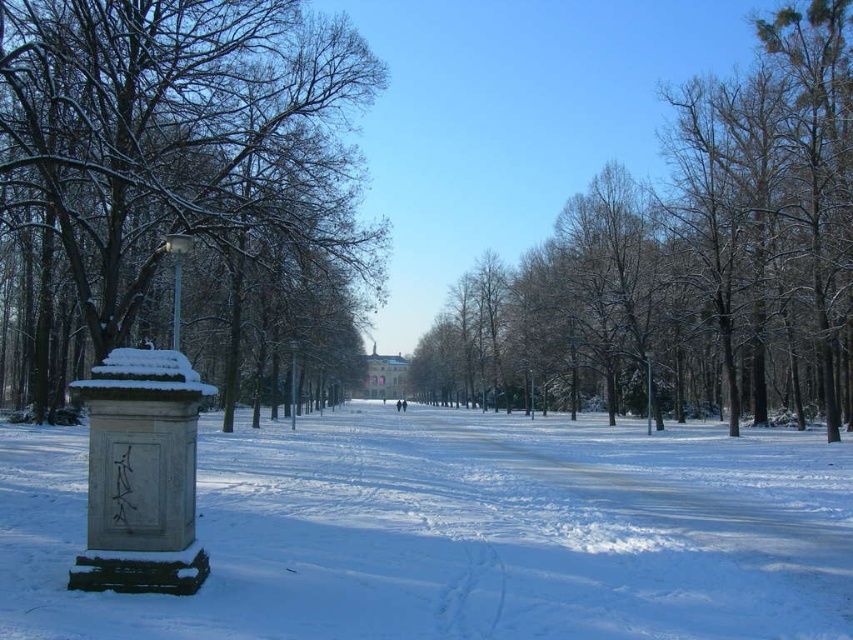
Question: Which is nearer to the white powdery snow at center?

Choices:
 (A) snow-covered tree at left
 (B) snow-covered trees at center

Answer: (A)

Question: Which is nearer to the snow-covered trees at center?

Choices:
 (A) snow-covered tree at left
 (B) white powdery snow at center

Answer: (B)

Question: Is snow-covered trees at center wider than snow-covered tree at left?

Choices:
 (A) no
 (B) yes

Answer: (B)

Question: Is white powdery snow at center positioned behind snow-covered tree at left?

Choices:
 (A) yes
 (B) no

Answer: (B)

Question: Can you confirm if white powdery snow at center is bigger than snow-covered tree at left?

Choices:
 (A) yes
 (B) no

Answer: (B)

Question: Which of these objects is positioned farthest from the snow-covered tree at left?

Choices:
 (A) white powdery snow at center
 (B) snow-covered trees at center

Answer: (B)